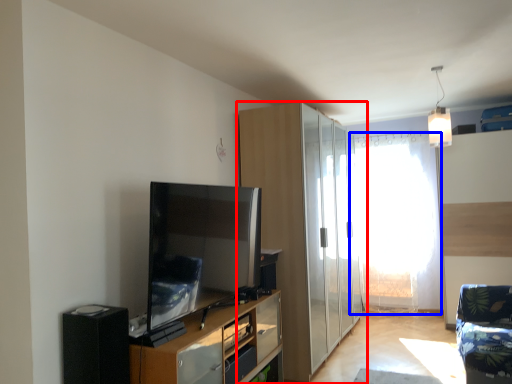
Question: Among these objects, which one is farthest to the camera, cabinetry (highlighted by a red box) or window screen (highlighted by a blue box)?

Choices:
 (A) cabinetry
 (B) window screen

Answer: (B)